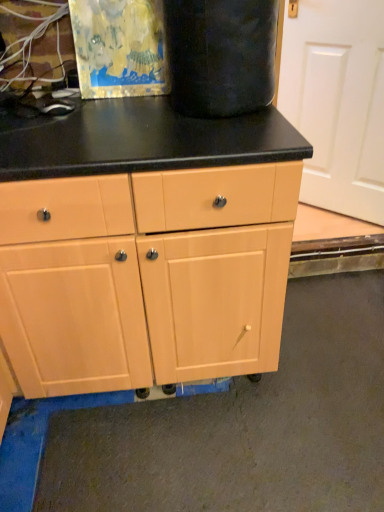
Question: Is matte wood cabinet at center outside of white matte screen door at upper right?

Choices:
 (A) yes
 (B) no

Answer: (A)

Question: From the image's perspective, does matte wood cabinet at center appear lower than white matte screen door at upper right?

Choices:
 (A) no
 (B) yes

Answer: (B)

Question: Is matte wood cabinet at center far away from white matte screen door at upper right?

Choices:
 (A) yes
 (B) no

Answer: (A)

Question: From the image's perspective, does matte wood cabinet at center appear higher than white matte screen door at upper right?

Choices:
 (A) yes
 (B) no

Answer: (B)

Question: Does matte wood cabinet at center appear on the left side of white matte screen door at upper right?

Choices:
 (A) no
 (B) yes

Answer: (B)

Question: Does matte wood cabinet at center have a larger size compared to white matte screen door at upper right?

Choices:
 (A) yes
 (B) no

Answer: (A)

Question: From the image's perspective, would you say white matte screen door at upper right is shown under matte wood cabinet at center?

Choices:
 (A) no
 (B) yes

Answer: (A)

Question: Is white matte screen door at upper right far from matte wood cabinet at center?

Choices:
 (A) yes
 (B) no

Answer: (A)

Question: Is white matte screen door at upper right at the left side of matte wood cabinet at center?

Choices:
 (A) no
 (B) yes

Answer: (A)

Question: Does white matte screen door at upper right have a lesser height compared to matte wood cabinet at center?

Choices:
 (A) no
 (B) yes

Answer: (A)

Question: Is white matte screen door at upper right to the right of matte wood cabinet at center from the viewer's perspective?

Choices:
 (A) no
 (B) yes

Answer: (B)

Question: Does white matte screen door at upper right have a greater width compared to matte wood cabinet at center?

Choices:
 (A) yes
 (B) no

Answer: (B)

Question: Is point (233, 293) positioned closer to the camera than point (340, 3)?

Choices:
 (A) farther
 (B) closer

Answer: (B)